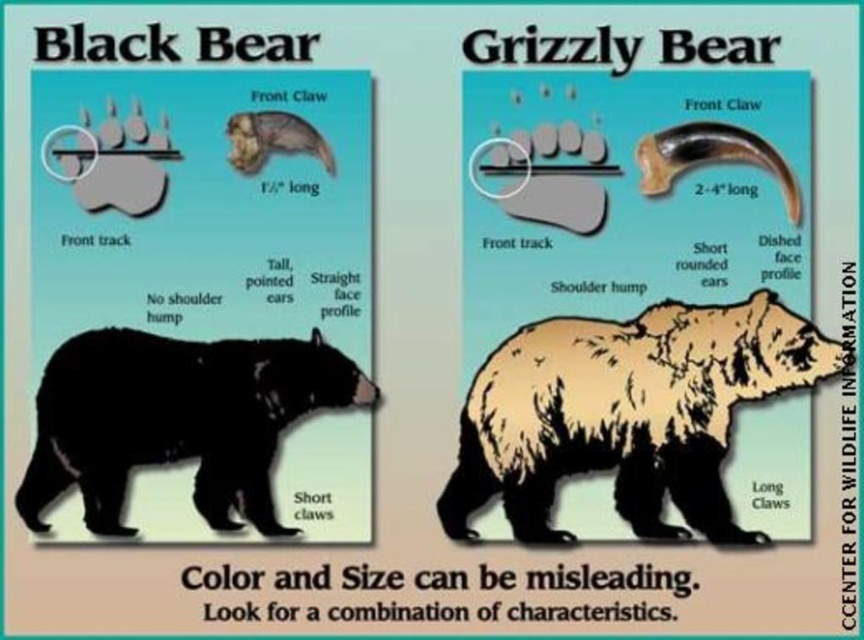
Question: Can you confirm if brown furry bear at center is wider than smooth brown claw at upper center?

Choices:
 (A) yes
 (B) no

Answer: (A)

Question: Is brown furry bear at center bigger than smooth brown claw at upper center?

Choices:
 (A) no
 (B) yes

Answer: (B)

Question: Is brown furry bear at center smaller than smooth brown claw at upper center?

Choices:
 (A) no
 (B) yes

Answer: (A)

Question: Estimate the real-world distances between objects in this image. Which object is closer to the black matte bear at lower left?

Choices:
 (A) brown furry bear at center
 (B) smooth brown claw at upper center

Answer: (B)

Question: Among these objects, which one is farthest from the camera?

Choices:
 (A) black matte bear at lower left
 (B) smooth brown claw at upper center
 (C) brown furry bear at center

Answer: (B)

Question: Based on their relative distances, which object is nearer to the brown furry bear at center?

Choices:
 (A) smooth brown claw at upper center
 (B) black matte bear at lower left

Answer: (B)